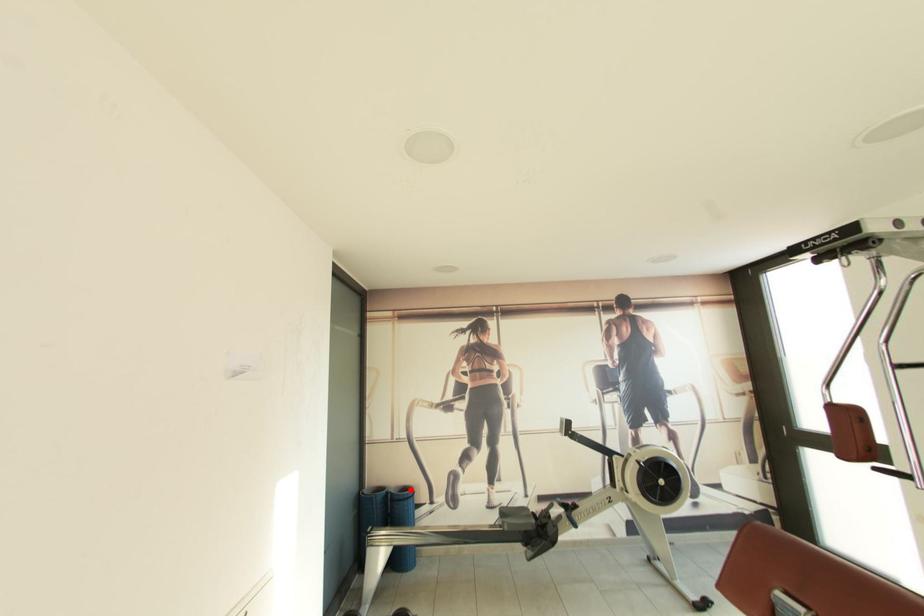
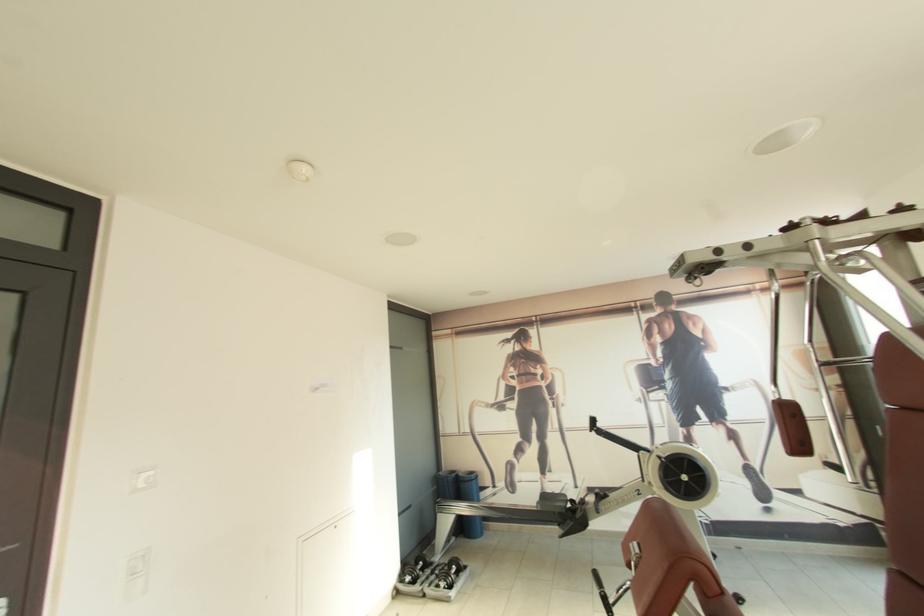
Question: A red point is marked in image1. In image2, is the corresponding 3D point closer to the camera or farther? Reply with the corresponding letter.

Choices:
 (A) The corresponding 3D point is closer.
 (B) The corresponding 3D point is farther.

Answer: (B)